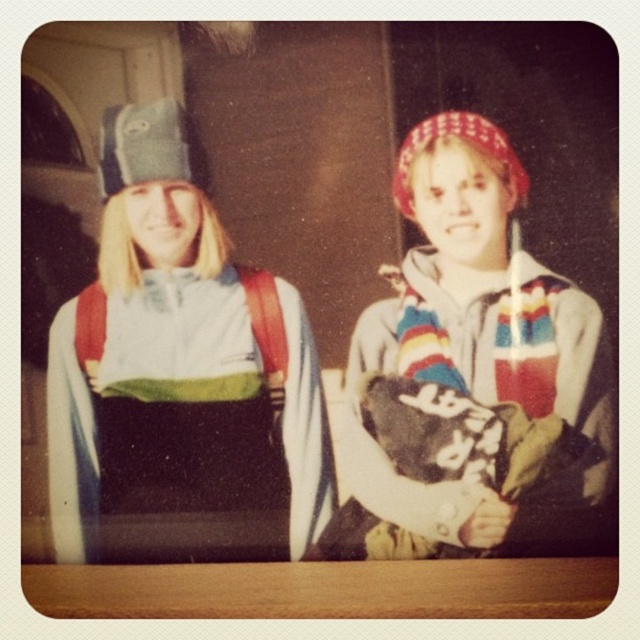
Does point (132, 131) come farther from viewer compared to point (422, 300)?

That is False.

Consider the image. Does matte blue ski jacket at left have a lesser width compared to matte multicolored hoodie at center?

In fact, matte blue ski jacket at left might be wider than matte multicolored hoodie at center.

Does point (452, 237) lie in front of point (524, 291)?

No, (452, 237) is further to viewer.

Identify the location of matte blue ski jacket at left. This screenshot has width=640, height=640. (317, 371).

Between matte blue ski jacket at left and matte white and green jacket at center, which one appears on the right side from the viewer's perspective?

From the viewer's perspective, matte blue ski jacket at left appears more on the right side.

Between matte blue ski jacket at left and matte white and green jacket at center, which one is positioned higher?

matte blue ski jacket at left is higher up.

Who is more distant from viewer, (294, 436) or (97, 445)?

Point (294, 436)

The width and height of the screenshot is (640, 640). What are the coordinates of `matte blue ski jacket at left` in the screenshot? It's located at (317, 371).

Does matte multicolored hoodie at center have a greater height compared to matte white and green jacket at center?

Correct, matte multicolored hoodie at center is much taller as matte white and green jacket at center.

Can you confirm if matte multicolored hoodie at center is positioned to the left of matte white and green jacket at center?

Incorrect, matte multicolored hoodie at center is not on the left side of matte white and green jacket at center.

What do you see at coordinates (470, 371) in the screenshot?
I see `matte multicolored hoodie at center` at bounding box center [470, 371].

Identify the location of matte multicolored hoodie at center. This screenshot has width=640, height=640. (470, 371).